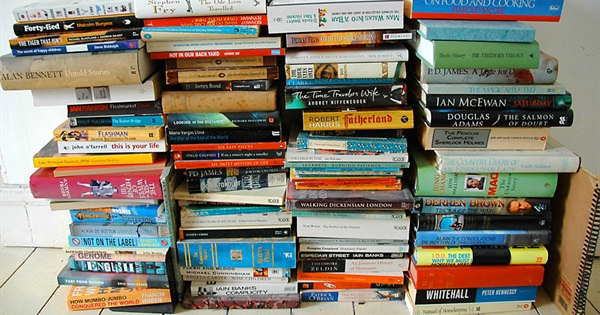
Image resolution: width=600 pixels, height=315 pixels. I want to click on white wall on left side of book, so click(11, 108), click(17, 137), click(36, 119), click(12, 162), click(4, 139), click(42, 132), click(10, 27), click(5, 8).